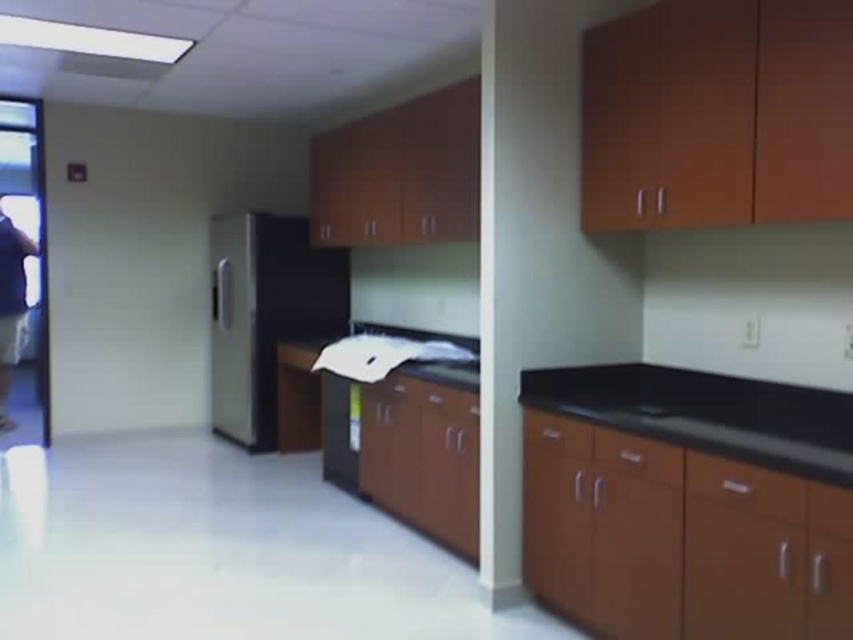
You are standing in the laboratory and need to place a 20 feet long equipment from the dark blue shirt at left to the black granite countertop at center. Is the distance sufficient?

The black granite countertop at center is 19.50 feet from the dark blue shirt at left. Since the equipment is 20 feet long, the distance is insufficient as it is 0.5 feet shorter than required.

You are organizing items in a modern kitchenette and need to place both the satin black refrigerator at center and the dark blue shirt at left. Which object requires more space due to its size?

The satin black refrigerator at center requires more space because it is bigger than the dark blue shirt at left.

In the scene shown: You are organizing items in the lab and need to place a new item between the satin black refrigerator at center and the dark blue shirt at left. Where should you position it?

You should place the new item between the satin black refrigerator at center and the dark blue shirt at left, positioning it to the right of the dark blue shirt at left and to the left of the satin black refrigerator at center since the refrigerator is to the right of the shirt.